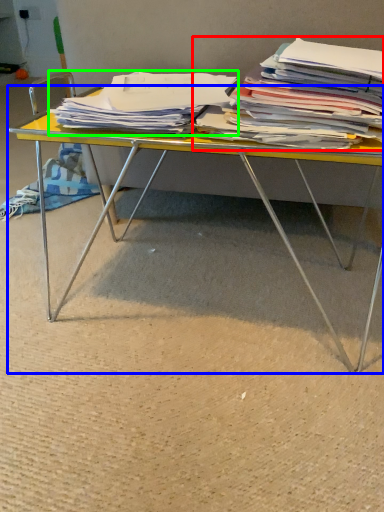
Question: Considering the real-world distances, which object is closest to magazine (highlighted by a red box)? desk (highlighted by a blue box) or magazine (highlighted by a green box).

Choices:
 (A) desk
 (B) magazine

Answer: (B)